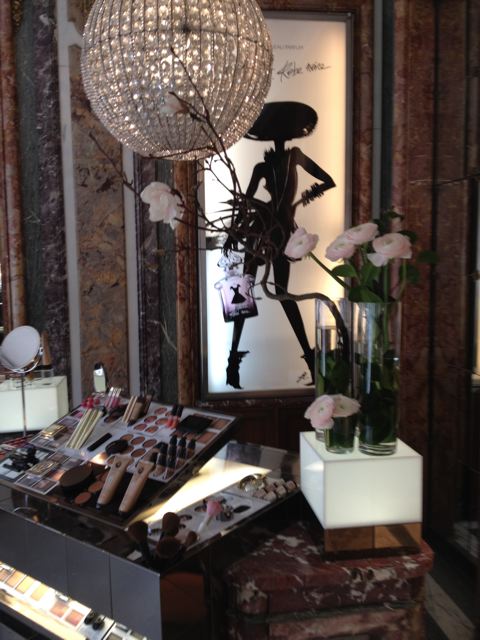
The width and height of the screenshot is (480, 640). I want to click on wall, so click(115, 266).